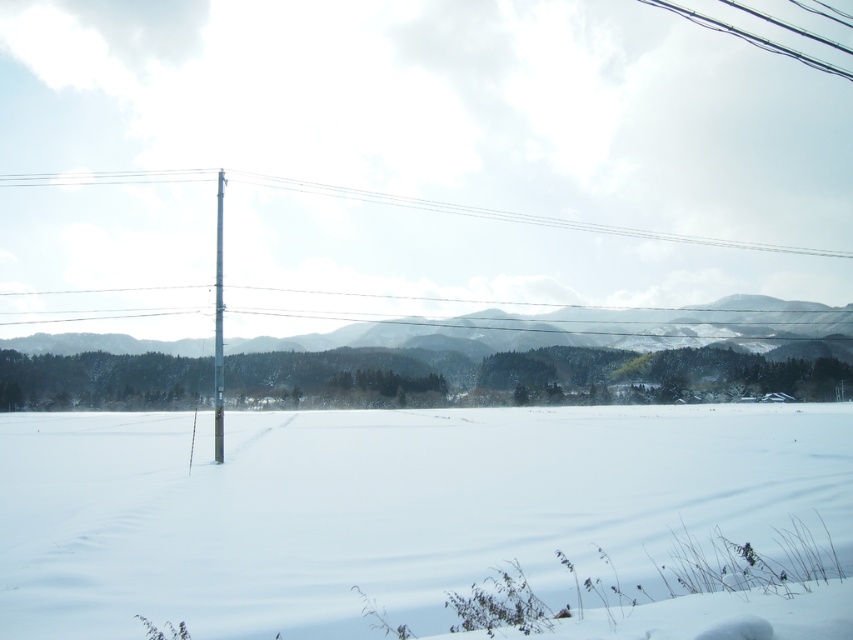
You are a photographer planning to capture a landscape photo that includes both the snowy forested mountain at left and the metallic silver pole at left. Considering their sizes, which object should you focus on to ensure both are clearly visible in the frame?

The snowy forested mountain at left is larger in size than the metallic silver pole at left, so focusing on the snowy forested mountain at left would ensure both objects are clearly visible in the frame.

You are a photographer planning to take a picture of the white fluffy snow at center and the metallic pole at upper center. Based on their positions, which object would appear closer to the camera in the photo?

The white fluffy snow at center appears closer to the camera than the metallic pole at upper center because it is positioned below the pole, which suggests it is in the foreground of the scene.